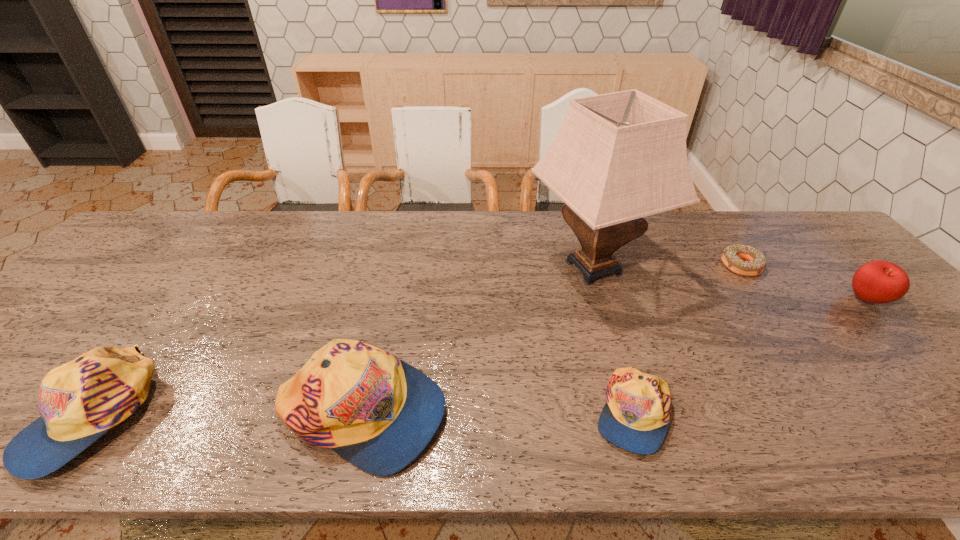
At what (x,y) coordinates should I click in order to perform the action: click on empty space that is in between the second cap from left to right and the second shortest object. Please return your answer as a coordinate pair (x, y). Looking at the image, I should click on (496, 413).

Find the location of a particular element. The image size is (960, 540). free space between the lampshade and the second object from right to left is located at coordinates (667, 267).

This screenshot has width=960, height=540. In order to click on vacant region between the rightmost object and the fifth object from left to right in this screenshot , I will do `click(804, 283)`.

At what (x,y) coordinates should I click in order to perform the action: click on blank region between the shortest object and the rightmost object. Please return your answer as a coordinate pair (x, y). This screenshot has width=960, height=540. Looking at the image, I should click on (804, 283).

At what (x,y) coordinates should I click in order to perform the action: click on unoccupied position between the second cap from left to right and the rightmost object. Please return your answer as a coordinate pair (x, y). This screenshot has width=960, height=540. Looking at the image, I should click on (614, 356).

Locate an element on the screen. This screenshot has height=540, width=960. free point between the lampshade and the rightmost object is located at coordinates (730, 284).

Select which object appears as the fifth closest to the second tallest cap. Please provide its 2D coordinates. Your answer should be formatted as a tuple, i.e. [(x, y)], where the tuple contains the x and y coordinates of a point satisfying the conditions above.

[(878, 282)]

Where is `the fourth closest object to the apple`? The image size is (960, 540). the fourth closest object to the apple is located at coordinates (379, 413).

The height and width of the screenshot is (540, 960). Identify the location of cap that is the second closest one to the fifth tallest object. (80, 401).

Locate an element on the screen. Image resolution: width=960 pixels, height=540 pixels. cap that is the closest to the rightmost object is located at coordinates (636, 416).